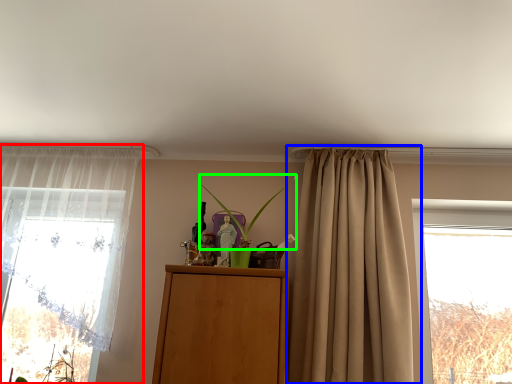
Question: Which is farther away from curtain (highlighted by a red box)? curtain (highlighted by a blue box) or plant (highlighted by a green box)?

Choices:
 (A) curtain
 (B) plant

Answer: (A)